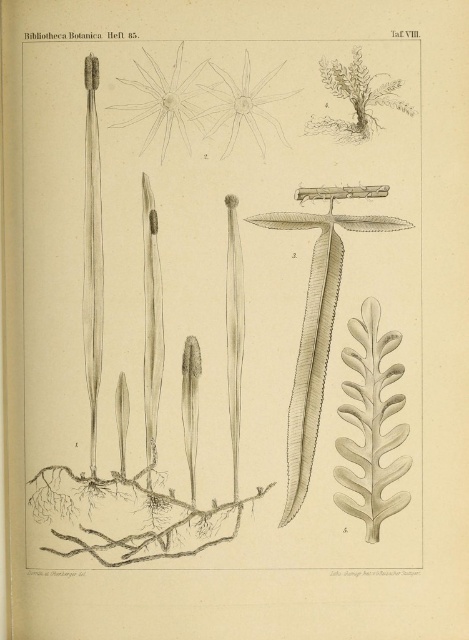
Question: Is gray pencil sketch of plant at center bigger than gray-green leafy plant at upper right?

Choices:
 (A) no
 (B) yes

Answer: (B)

Question: Which object is farther from the camera taking this photo?

Choices:
 (A) gray textured leaf at center right
 (B) white paper flower at upper center
 (C) gray pencil sketch flower at upper center

Answer: (A)

Question: Is gray textured leaf at center right wider than gray-green leafy plant at upper right?

Choices:
 (A) yes
 (B) no

Answer: (B)

Question: Which of the following is the farthest from the observer?

Choices:
 (A) gray pencil sketch flower at upper center
 (B) gray-green leafy plant at upper right
 (C) gray textured leaf at center right
 (D) white paper flower at upper center

Answer: (C)

Question: Which point is farther to the camera?

Choices:
 (A) white paper flower at upper center
 (B) gray-green leafy plant at upper right
 (C) gray pencil sketch flower at upper center
 (D) gray textured leaf at center right

Answer: (D)

Question: Does gray pencil sketch of plant at center have a larger size compared to white paper flower at upper center?

Choices:
 (A) no
 (B) yes

Answer: (B)